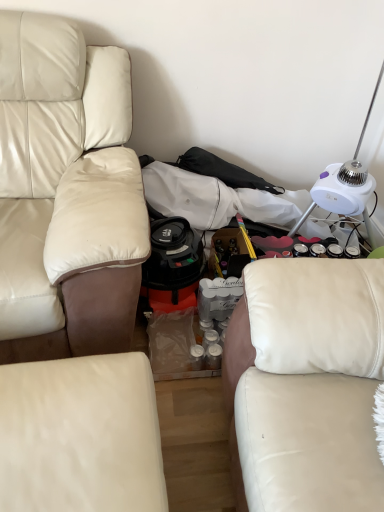
Question: Looking at their shapes, would you say white plastic table lamp at upper right is wider or thinner than beige leather couch at left, which appears as the 3th studio couch when viewed from the right?

Choices:
 (A) thin
 (B) wide

Answer: (A)

Question: In terms of height, does white plastic table lamp at upper right look taller or shorter compared to beige leather couch at left, which appears as the 3th studio couch when viewed from the right?

Choices:
 (A) tall
 (B) short

Answer: (B)

Question: Estimate the real-world distances between objects in this image. Which object is closer to the white leather studio couch at right, the first studio couch when ordered from right to left?

Choices:
 (A) beige leather couch at left, which appears as the 3th studio couch when viewed from the right
 (B) white leather studio couch at lower center, which appears as the second studio couch when viewed from the right
 (C) white plastic table lamp at upper right

Answer: (B)

Question: Which is farther from the white leather studio couch at lower center, arranged as the 2th studio couch when viewed from the left?

Choices:
 (A) white leather studio couch at right, the first studio couch when ordered from right to left
 (B) white plastic table lamp at upper right
 (C) beige leather couch at left, which appears as the 3th studio couch when viewed from the right

Answer: (B)